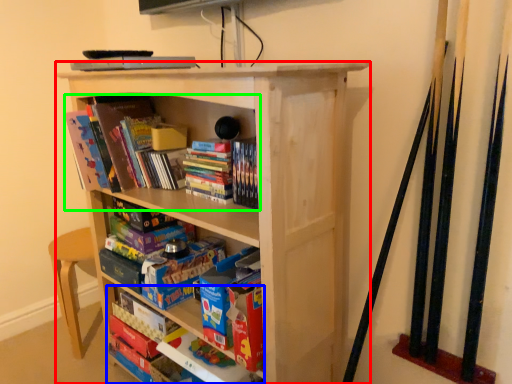
Question: Which is nearer to the bookcase (highlighted by a red box)? book (highlighted by a blue box) or book (highlighted by a green box).

Choices:
 (A) book
 (B) book

Answer: (B)